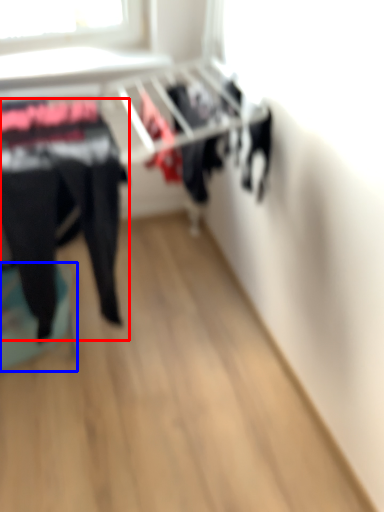
Question: Among these objects, which one is nearest to the camera, clothing (highlighted by a red box) or furniture (highlighted by a blue box)?

Choices:
 (A) clothing
 (B) furniture

Answer: (A)